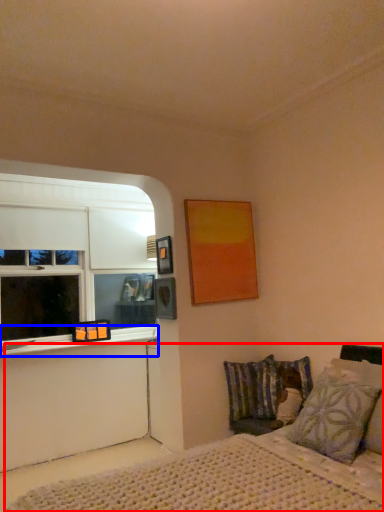
Question: Which of the following is the closest to the observer, bed (highlighted by a red box) or window sill (highlighted by a blue box)?

Choices:
 (A) bed
 (B) window sill

Answer: (A)